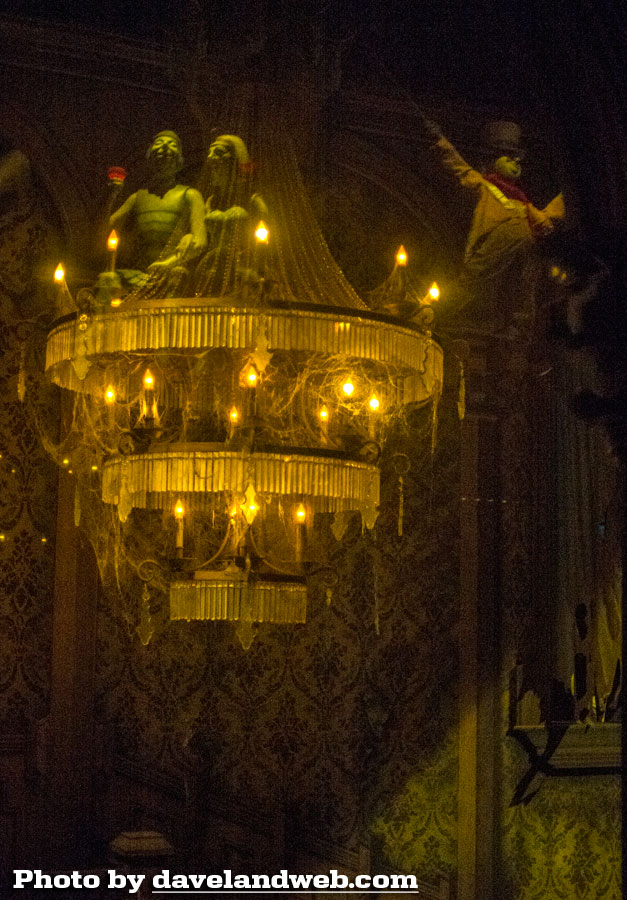
Where is `statue on the right`? Image resolution: width=627 pixels, height=900 pixels. statue on the right is located at coordinates (510, 202).